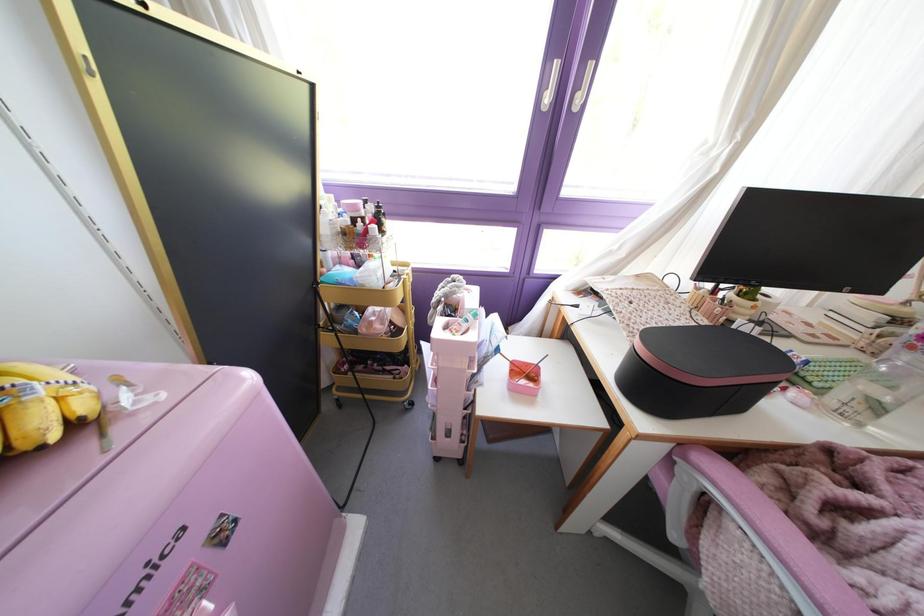
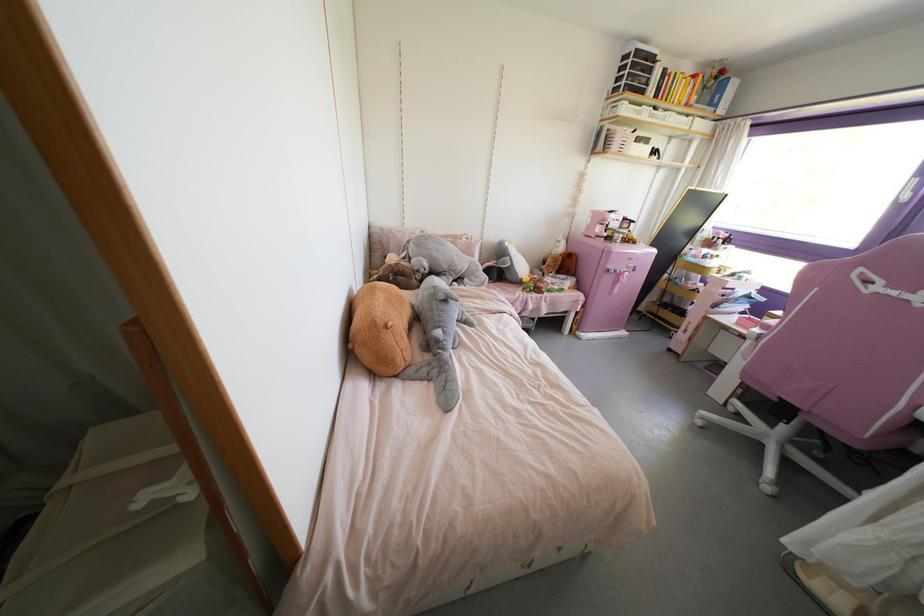
Where in the second image is the point corresponding to [224,541] from the first image?

(633, 270)